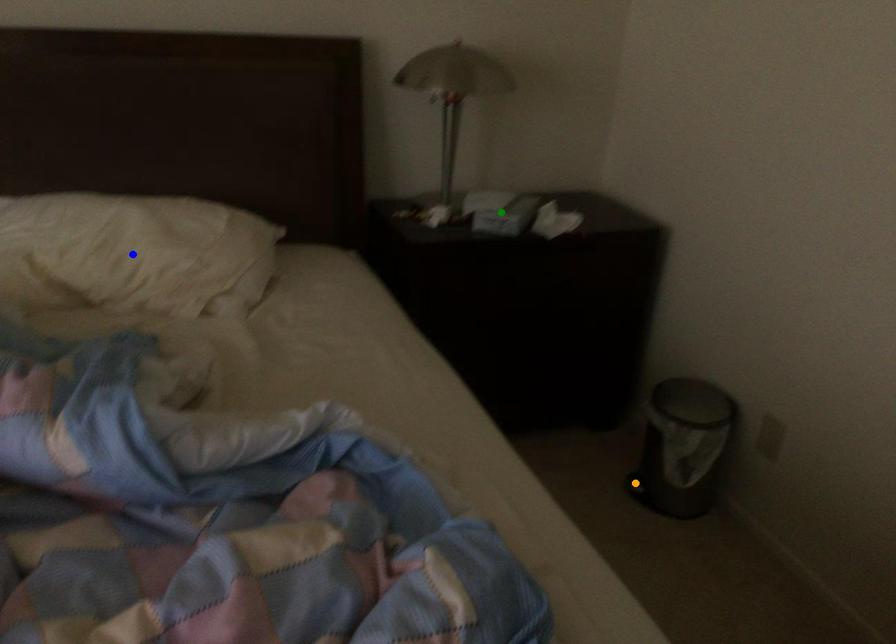
Order these from nearest to farthest:
- orange point
- green point
- blue point

blue point < green point < orange point